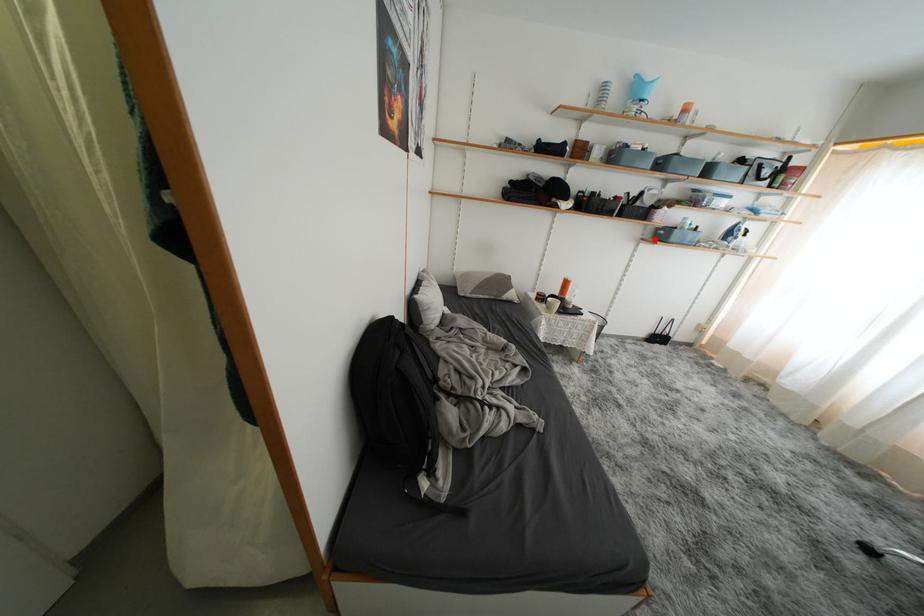
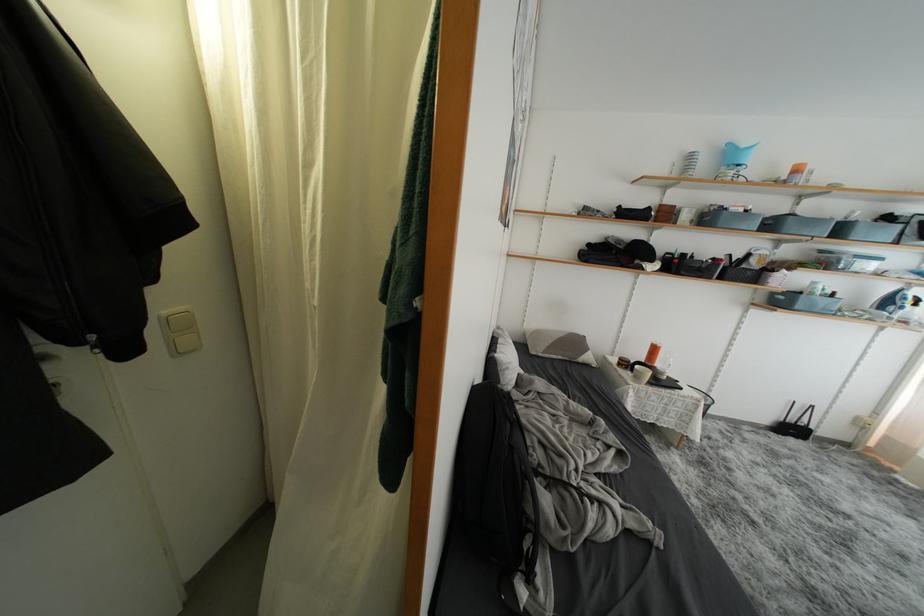
Question: I am providing you with two images of the same scene from different viewpoints. In image1, a red point is highlighted. Considering the same 3D point in image2, which of the following is correct?

Choices:
 (A) It is closer
 (B) It is farther

Answer: (B)